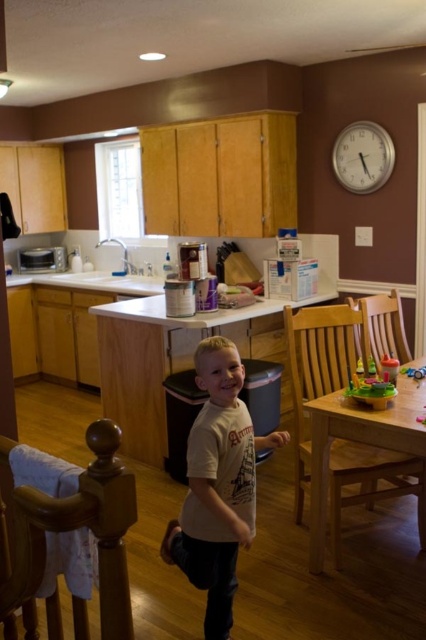
You are a parent trying to tidy up the kitchen. You see the light beige cotton shirt at center and the wooden chair at lower left. Which item should you pick up first if you want to start cleaning from the lowest point in the room?

The light beige cotton shirt at center should be picked up first because it is located below the wooden chair at lower left, making it the lower item in the room.

Consider the image. You are a parent in the kitchen and want to place your child on the wooden chair at right to play with the translucent plastic toy at table. Can you put the child on the chair so they can easily reach the toy?

The wooden chair at right is to the right of the translucent plastic toy at table, so placing the child on the wooden chair at right would position them to the right of the toy. This might make it harder for them to reach it easily. Consider moving the toy closer or adjusting their position for better access.

You are a parent trying to seat your child at the wooden chair at lower left and the light brown wooden table at lower right. Which object is shorter so that your child can sit comfortably without a stool?

The wooden chair at lower left is shorter than the light brown wooden table at lower right, so the child can sit comfortably on it without needing a stool.